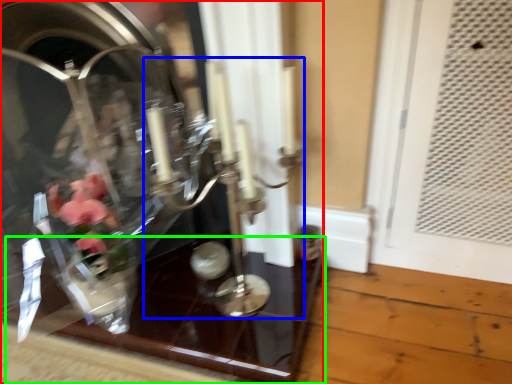
Question: Which object is the closest to the glass box (highlighted by a red box)? Choose among these: candle holder (highlighted by a blue box) or glass table (highlighted by a green box).

Choices:
 (A) candle holder
 (B) glass table

Answer: (B)